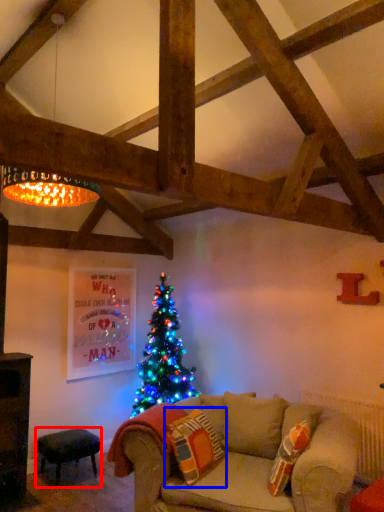
Question: Which of the following is the closest to the observer, stool (highlighted by a red box) or pillow (highlighted by a blue box)?

Choices:
 (A) stool
 (B) pillow

Answer: (B)